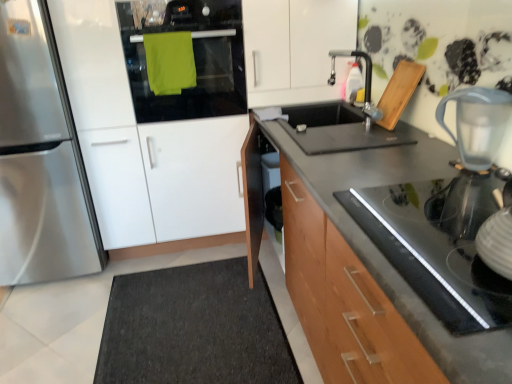
Question: Relative to dark gray carpet at lower left, is transparent plastic pitcher at upper right in front or behind?

Choices:
 (A) front
 (B) behind

Answer: (A)

Question: Looking at their shapes, would you say transparent plastic pitcher at upper right is wider or thinner than dark gray carpet at lower left?

Choices:
 (A) wide
 (B) thin

Answer: (B)

Question: Estimate the real-world distances between objects in this image. Which object is closer to the black glass cooktop at lower right?

Choices:
 (A) metallic faucet at upper right
 (B) dark gray carpet at lower left
 (C) wooden cabinet at center
 (D) transparent plastic pitcher at upper right
 (E) satin silver refrigerator at left

Answer: (D)

Question: Based on their relative distances, which object is farther from the black glass cooktop at lower right?

Choices:
 (A) transparent plastic pitcher at upper right
 (B) wooden cabinet at center
 (C) metallic faucet at upper right
 (D) satin silver refrigerator at left
 (E) dark gray carpet at lower left

Answer: (D)